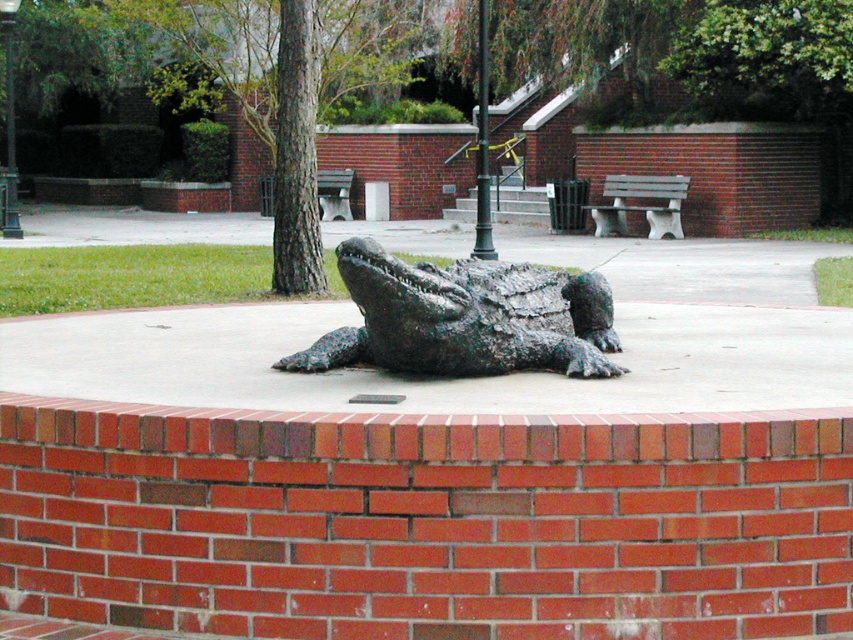
Question: In this image, where is shiny bronze crocodile at center located relative to wooden bench at center?

Choices:
 (A) left
 (B) right

Answer: (A)

Question: Which object is farther from the camera taking this photo?

Choices:
 (A) wooden bench at center
 (B) shiny bronze crocodile at center

Answer: (A)

Question: Is shiny bronze crocodile at center below wooden bench at center?

Choices:
 (A) yes
 (B) no

Answer: (A)

Question: Which point is closer to the camera taking this photo?

Choices:
 (A) (579, 339)
 (B) (657, 234)

Answer: (A)

Question: Can you confirm if shiny bronze crocodile at center is bigger than wooden bench at center?

Choices:
 (A) no
 (B) yes

Answer: (A)

Question: Which point is closer to the camera?

Choices:
 (A) (508, 292)
 (B) (606, 189)

Answer: (A)